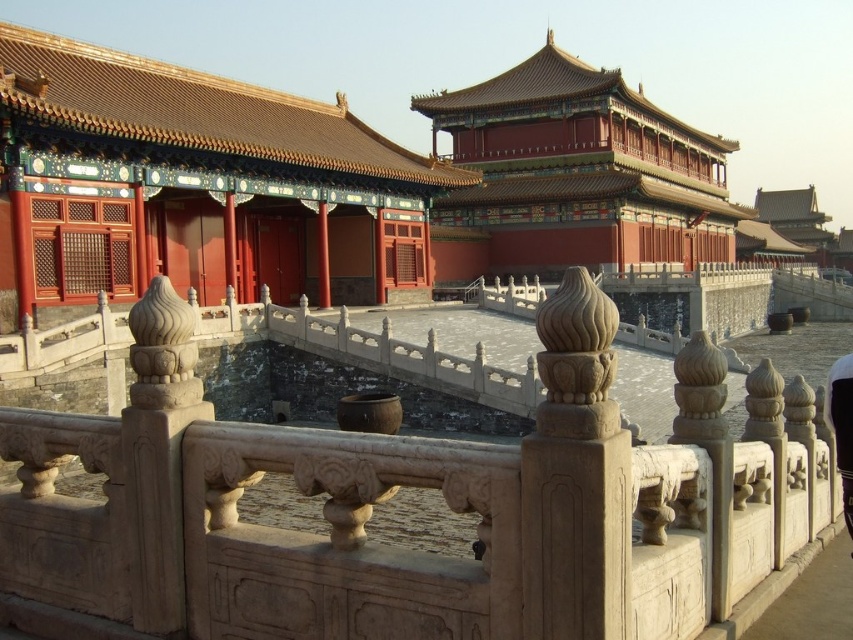
Question: Among these objects, which one is nearest to the camera?

Choices:
 (A) red lacquered wood palace at upper center
 (B) matte red wood palace at center
 (C) stone bridge at center

Answer: (C)

Question: Is stone bridge at center further to camera compared to matte red wood palace at center?

Choices:
 (A) yes
 (B) no

Answer: (B)

Question: Does stone bridge at center appear over matte red wood palace at center?

Choices:
 (A) yes
 (B) no

Answer: (B)

Question: Which point is closer to the camera?

Choices:
 (A) matte red wood palace at center
 (B) stone bridge at center
 (C) red lacquered wood palace at upper center

Answer: (B)

Question: Estimate the real-world distances between objects in this image. Which object is closer to the matte red wood palace at center?

Choices:
 (A) stone bridge at center
 (B) red lacquered wood palace at upper center

Answer: (A)

Question: Does stone bridge at center appear on the right side of matte red wood palace at center?

Choices:
 (A) no
 (B) yes

Answer: (B)